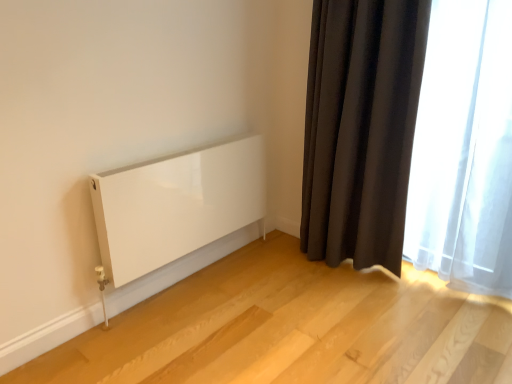
The height and width of the screenshot is (384, 512). What do you see at coordinates (464, 149) in the screenshot?
I see `silky white curtain at right` at bounding box center [464, 149].

Where is `silky white curtain at right`? The height and width of the screenshot is (384, 512). silky white curtain at right is located at coordinates (464, 149).

Find the location of a particular element. silky white curtain at right is located at coordinates (464, 149).